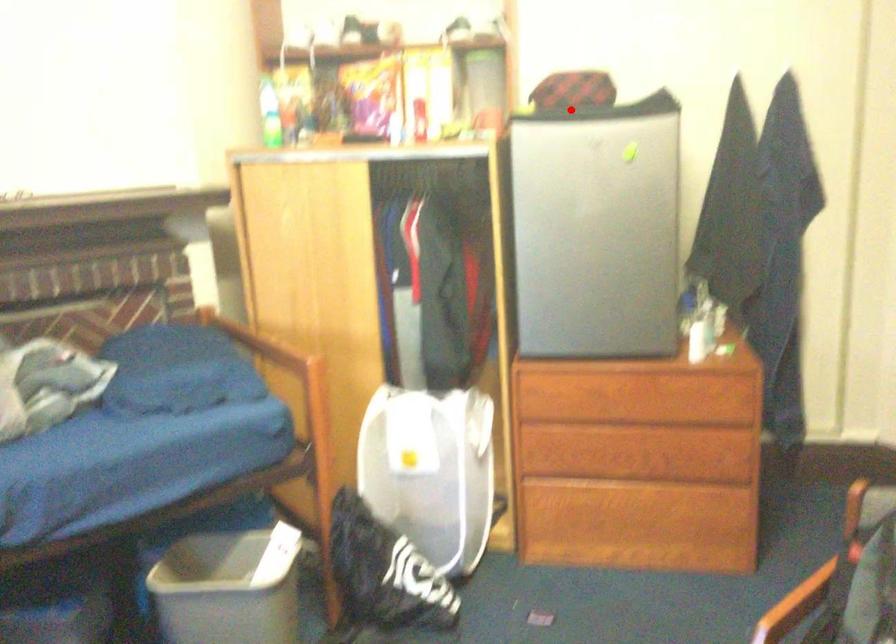
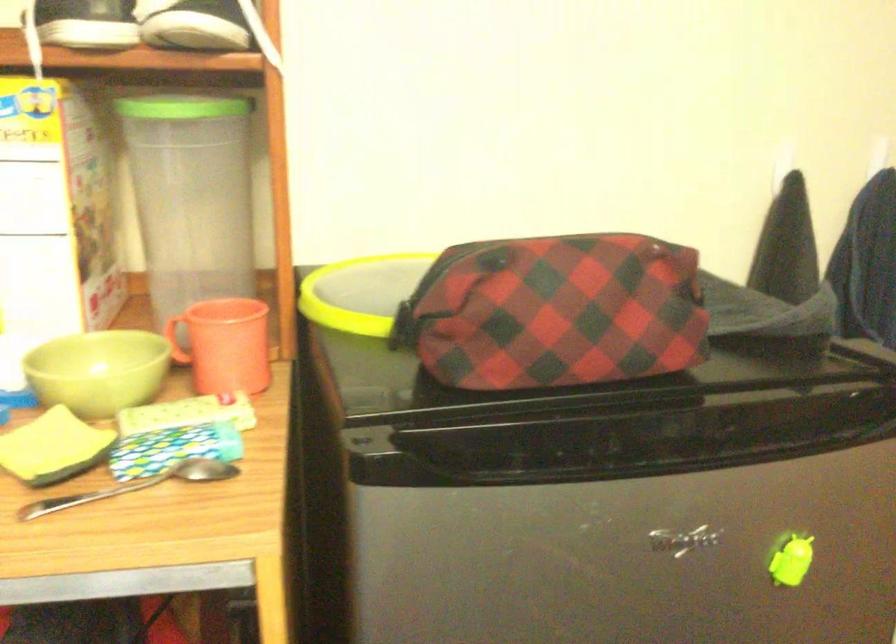
Locate, in the second image, the point that corresponds to the highlighted location in the first image.

(556, 430)